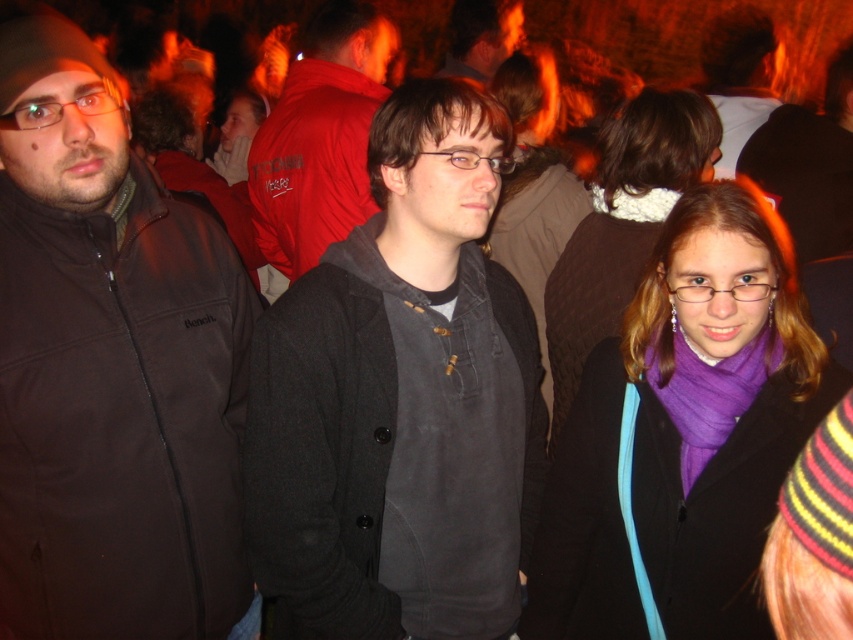
You are at a social event and see two items at the center of the scene. The items are the purple wool scarf at center and the red matte jacket at center. Which item is positioned lower?

The purple wool scarf at center is located below the red matte jacket at center, so it is positioned lower.

Consider the image. You are organizing a fashion show and need to place two purple scarves, the purple wool scarf at center and the purple knitted scarf at center, on a display table. The table is 30 inches long. Can both scarves fit side by side on the table without overlapping?

The purple wool scarf at center and purple knitted scarf at center are 33.10 inches apart, so they cannot fit side by side on a 30 inch table without overlapping.

In the scene shown: You are a photographer standing in front of the scene. You want to take a closeup shot of the purple wool scarf at center without moving any objects. Can you do it with your standard camera lens which has a minimum focusing distance of 1 meter?

→ The purple wool scarf at center is 1.53 meters from viewer, so yes, the photographer can take a closeup shot since the distance is within the camera lens minimum focusing distance of 1 meter.